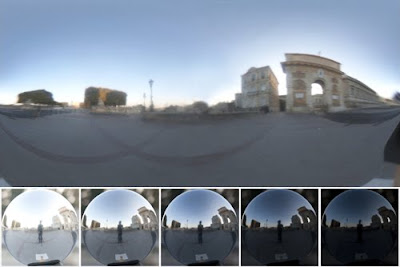
You are a GUI agent. You are given a task and a screenshot of the screen. Output one action in this format:
    pyautogui.click(x=<x>, y=<y>)
    Task: Click on the dark mirror
    Image resolution: width=400 pixels, height=267 pixels.
    Given the screenshot: What is the action you would take?
    (364, 238)